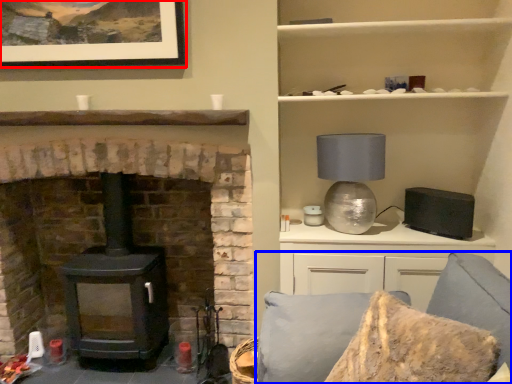
Question: Which object appears closest to the camera in this image, picture frame (highlighted by a red box) or couch (highlighted by a blue box)?

Choices:
 (A) picture frame
 (B) couch

Answer: (B)